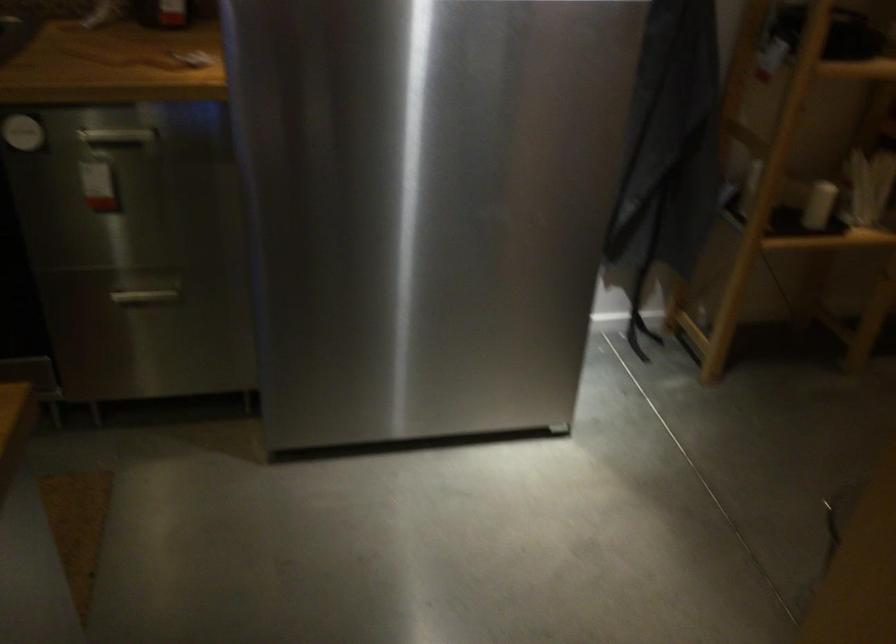
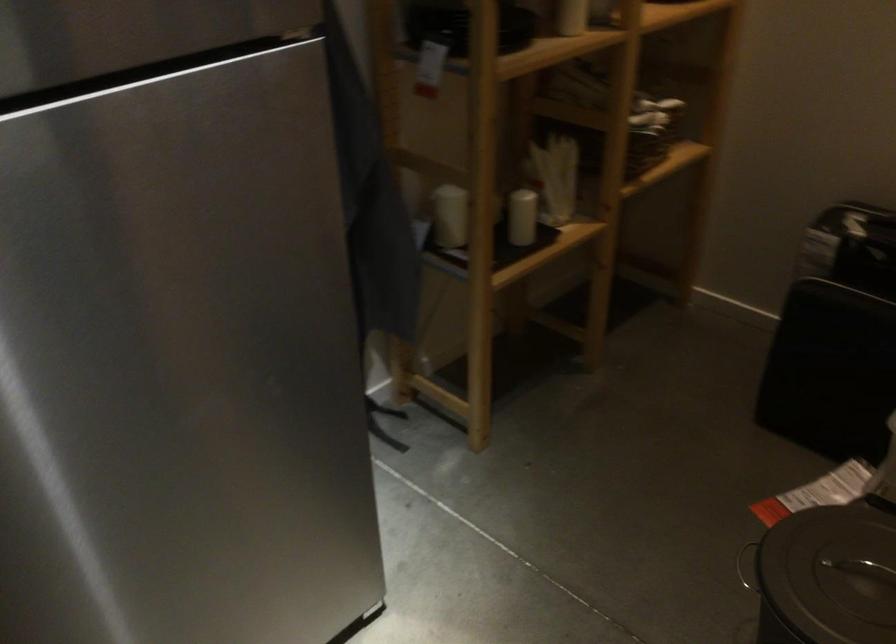
Question: Based on the continuous images, in which direction is the camera rotating? Reply with the corresponding letter.

Choices:
 (A) Left
 (B) Right
 (C) Up
 (D) Down

Answer: (B)